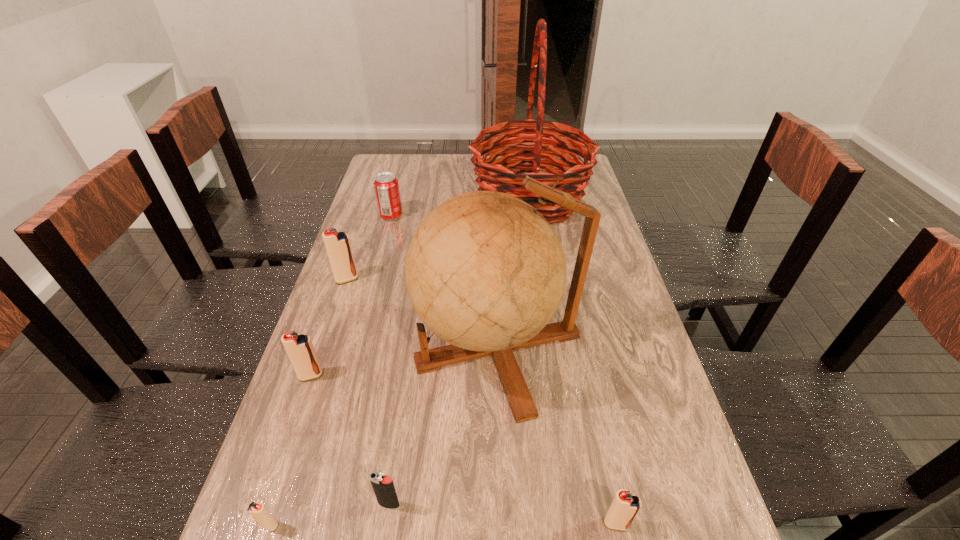
Identify the location of basket. (494, 174).

Where is `the second tallest object`? The width and height of the screenshot is (960, 540). the second tallest object is located at coordinates (485, 271).

This screenshot has width=960, height=540. Find the location of `the biggest red igniter`. the biggest red igniter is located at coordinates (337, 244).

Locate an element on the screen. the tallest igniter is located at coordinates (337, 244).

At what (x,y) coordinates should I click in order to perform the action: click on the fourth object from left to right. Please return your answer as a coordinate pair (x, y). The image size is (960, 540). Looking at the image, I should click on (386, 186).

You are a GUI agent. You are given a task and a screenshot of the screen. Output one action in this format:
    pyautogui.click(x=<x>, y=<y>)
    Task: Click on the second farthest igniter
    
    Given the screenshot: What is the action you would take?
    pyautogui.click(x=299, y=348)

Find the location of a particular element. This screenshot has height=540, width=960. the fourth shortest igniter is located at coordinates (299, 348).

At what (x,y) coordinates should I click in order to perform the action: click on the third nearest igniter. Please return your answer as a coordinate pair (x, y). This screenshot has height=540, width=960. Looking at the image, I should click on (383, 486).

Identify the location of the fourth igniter from left to right. (383, 486).

Find the location of a particular element. the rightmost red igniter is located at coordinates (625, 506).